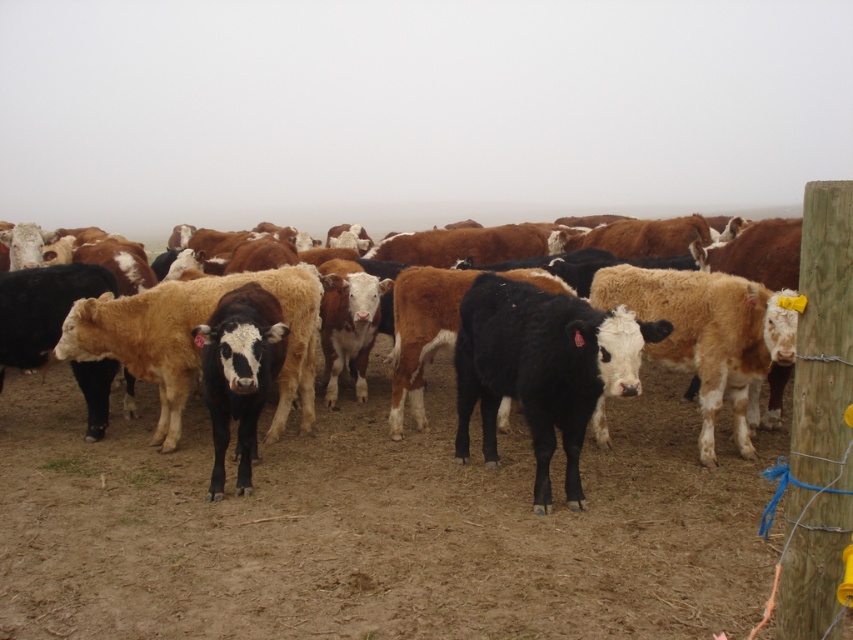
Which of these two, brown/white fur at center or black glossy cow at center, stands shorter?

brown/white fur at center

Does brown/white fur at center lie in front of black glossy cow at center?

Yes, brown/white fur at center is closer to the viewer.

Does point (343, 435) come closer to viewer compared to point (230, 312)?

No.

I want to click on brown/white fur at center, so click(x=369, y=488).

Which is above, brown/white fur at center or black smooth cow at center?

black smooth cow at center is higher up.

Measure the distance between point [204,611] and camera.

A distance of 10.34 feet exists between point [204,611] and camera.

Between point (450, 520) and point (526, 339), which one is positioned behind?

Positioned behind is point (526, 339).

Identify the location of brown/white fur at center. The image size is (853, 640). (369, 488).

Is black smooth cow at center to the left of black glossy cow at center from the viewer's perspective?

No, black smooth cow at center is not to the left of black glossy cow at center.

Looking at this image, between black smooth cow at center and black glossy cow at center, which one appears on the left side from the viewer's perspective?

black glossy cow at center is more to the left.

At what (x,y) coordinates should I click in order to perform the action: click on black smooth cow at center. Please return your answer as a coordinate pair (x, y). Looking at the image, I should click on (543, 369).